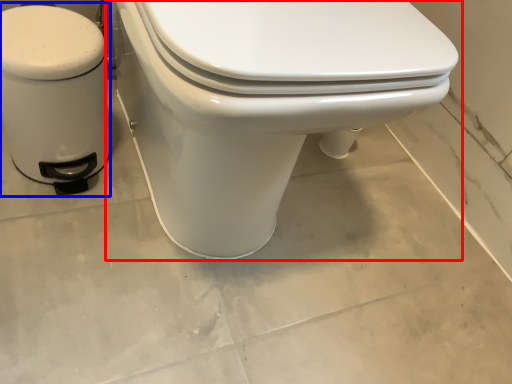
Question: Which object appears closest to the camera in this image, toilet (highlighted by a red box) or water heater (highlighted by a blue box)?

Choices:
 (A) toilet
 (B) water heater

Answer: (A)